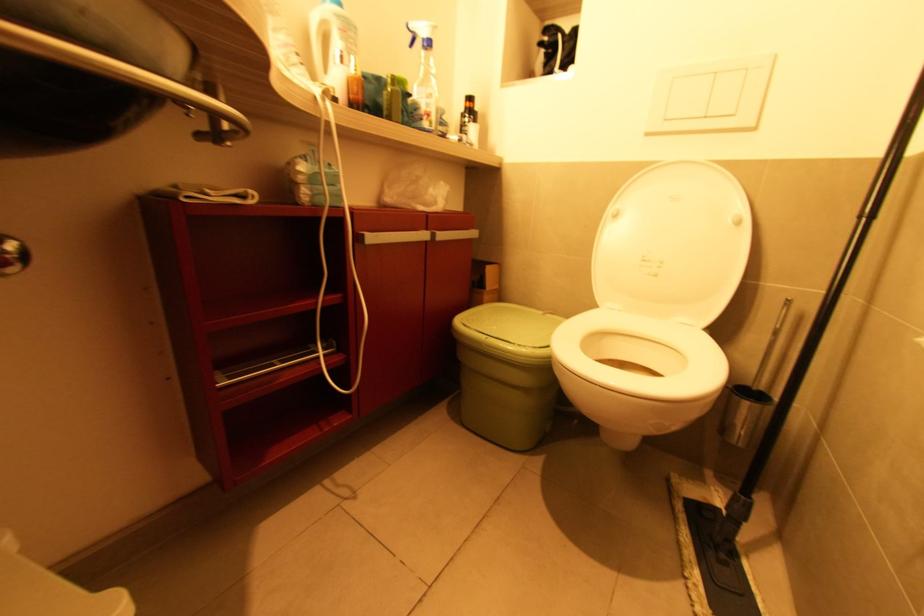
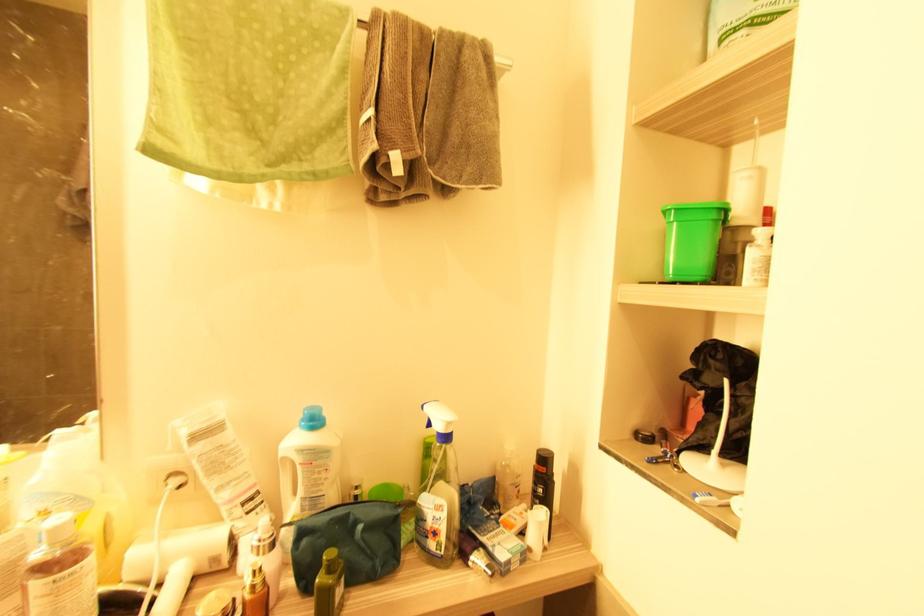
Find the pixel in the second image that matches [432,46] in the first image.

(447, 438)